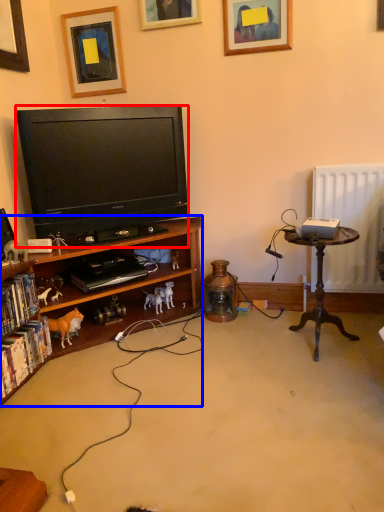
Question: Which point is further to the camera, television (highlighted by a red box) or bookcase (highlighted by a blue box)?

Choices:
 (A) television
 (B) bookcase

Answer: (A)